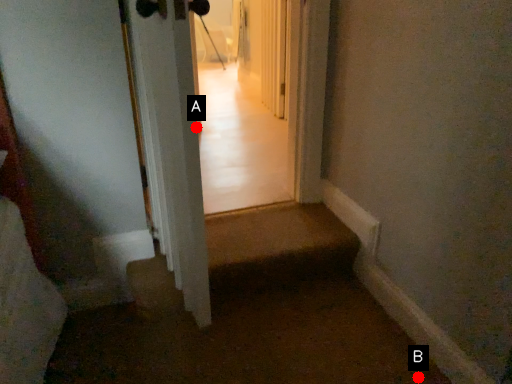
Question: Two points are circled on the image, labeled by A and B beside each circle. Which point is closer to the camera taking this photo?

Choices:
 (A) A is closer
 (B) B is closer

Answer: (A)